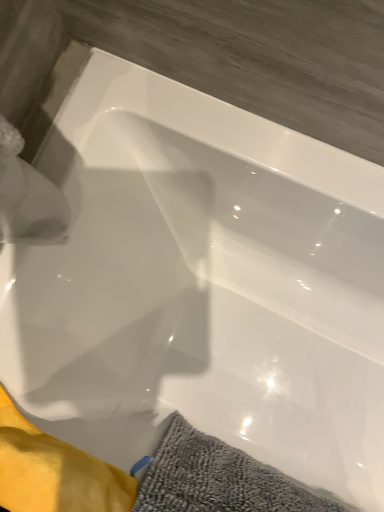
This screenshot has height=512, width=384. What do you see at coordinates (220, 479) in the screenshot?
I see `gray textured towel at bottom` at bounding box center [220, 479].

This screenshot has width=384, height=512. I want to click on gray textured towel at bottom, so click(220, 479).

What are the coordinates of `gray textured towel at bottom` in the screenshot? It's located at (220, 479).